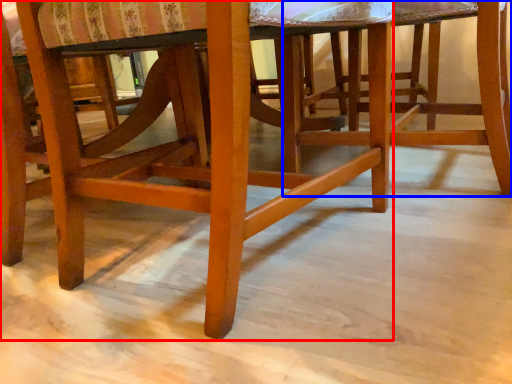
Question: Which object is closer to the camera taking this photo, chair (highlighted by a red box) or stool (highlighted by a blue box)?

Choices:
 (A) chair
 (B) stool

Answer: (A)